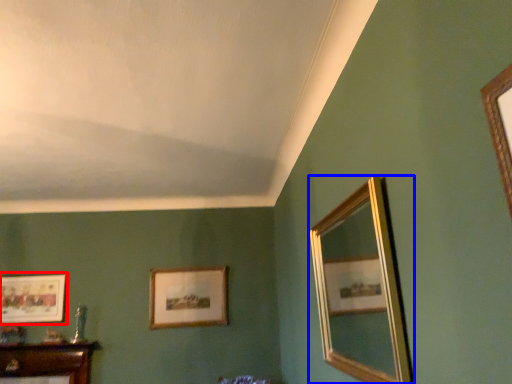
Question: Which object is closer to the camera taking this photo, picture frame (highlighted by a red box) or mirror (highlighted by a blue box)?

Choices:
 (A) picture frame
 (B) mirror

Answer: (B)